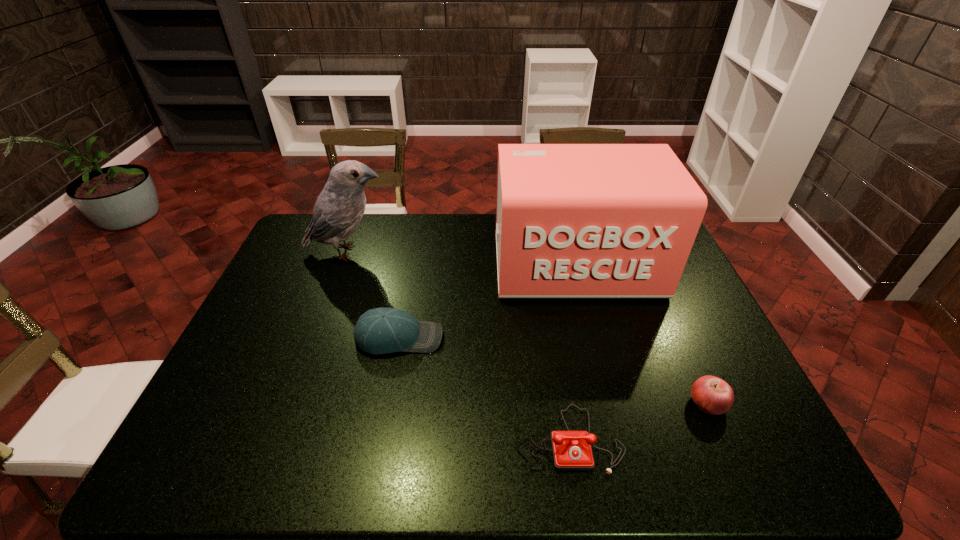
The height and width of the screenshot is (540, 960). In the image, there is a desktop. Find the location of `vacant space at the far left corner`. vacant space at the far left corner is located at coordinates (301, 232).

Where is `vacant area at the near left corner of the desktop`? vacant area at the near left corner of the desktop is located at coordinates (214, 475).

Locate an element on the screen. vacant area that lies between the telephone and the parrot is located at coordinates (458, 345).

The image size is (960, 540). Identify the location of free space that is in between the apple and the parrot. (528, 328).

Locate an element on the screen. Image resolution: width=960 pixels, height=540 pixels. vacant area between the baseball cap and the box is located at coordinates (488, 301).

The width and height of the screenshot is (960, 540). Find the location of `free space that is in between the box and the apple`. free space that is in between the box and the apple is located at coordinates (642, 334).

Identify the location of free space between the parrot and the apple. (528, 328).

Where is `vacant area that lies between the parrot and the box`? Image resolution: width=960 pixels, height=540 pixels. vacant area that lies between the parrot and the box is located at coordinates (462, 259).

The width and height of the screenshot is (960, 540). I want to click on free point between the box and the apple, so click(x=642, y=334).

Locate an element on the screen. vacant point located between the apple and the box is located at coordinates (642, 334).